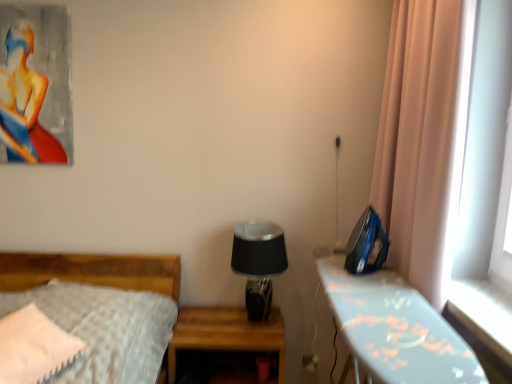
You are a GUI agent. You are given a task and a screenshot of the screen. Output one action in this format:
    pyautogui.click(x=<x>, y=<y>)
    Task: Click on the free space above wooden nightstand at center, which is the second nightstand in right-to-left order (from a real-world perspective)
    The image size is (512, 384).
    Given the screenshot: What is the action you would take?
    pyautogui.click(x=221, y=324)